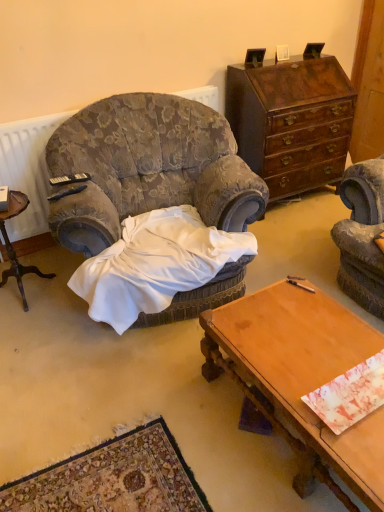
Where is `empty space that is to the right of wooden nightstand at left`? The height and width of the screenshot is (512, 384). empty space that is to the right of wooden nightstand at left is located at coordinates (63, 302).